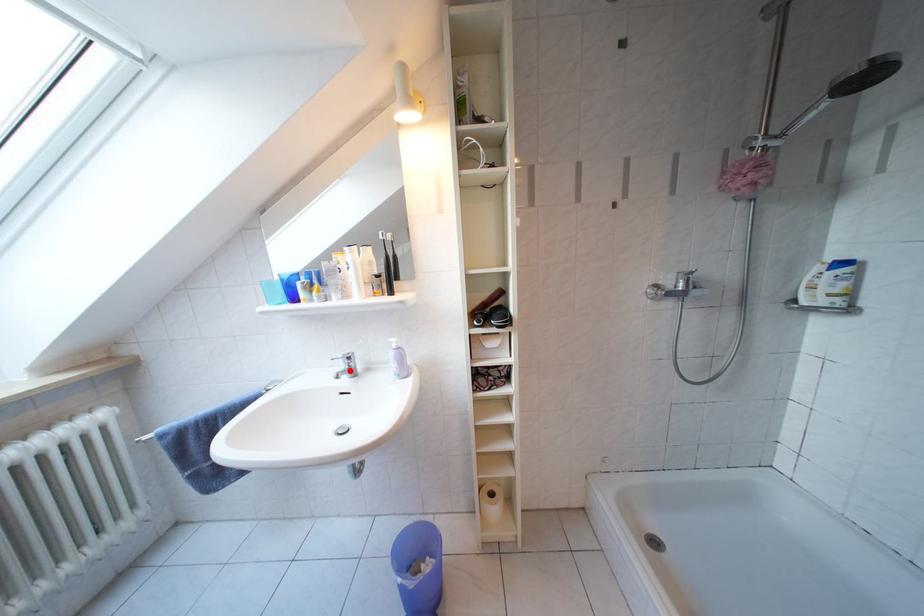
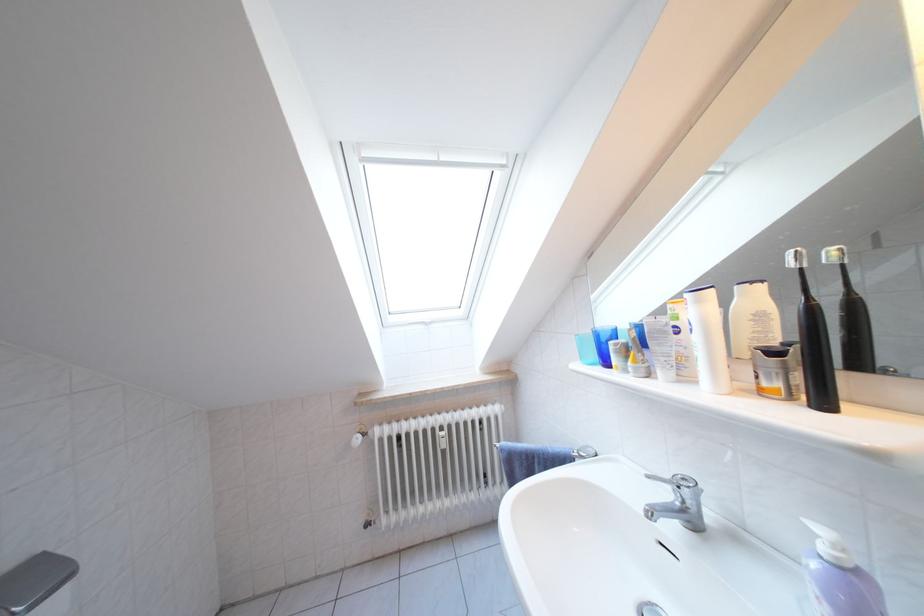
In the second image, find the point that corresponds to the highlighted location in the first image.

(675, 500)